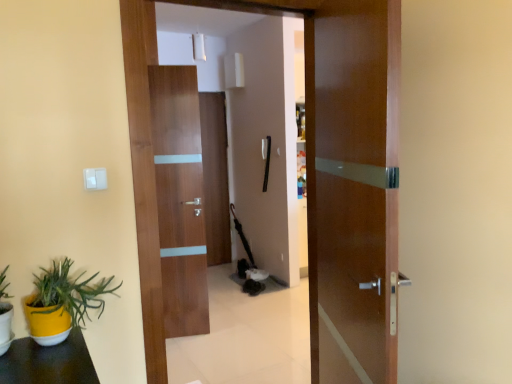
Question: Does glossy wood door at center, arranged as the first door when viewed from the front, lie in front of matte wood door at center, which ranks as the first door in back-to-front order?

Choices:
 (A) yes
 (B) no

Answer: (A)

Question: Is matte wood door at center, which ranks as the first door in back-to-front order, at the back of glossy wood door at center, which ranks as the 4th door in back-to-front order?

Choices:
 (A) yes
 (B) no

Answer: (B)

Question: Is glossy wood door at center, which ranks as the 4th door in back-to-front order, wider than matte wood door at center, positioned as the 4th door in front-to-back order?

Choices:
 (A) no
 (B) yes

Answer: (B)

Question: From a real-world perspective, does glossy wood door at center, which ranks as the 4th door in back-to-front order, stand above matte wood door at center, positioned as the 4th door in front-to-back order?

Choices:
 (A) no
 (B) yes

Answer: (B)

Question: Is glossy wood door at center, arranged as the first door when viewed from the front, smaller than matte wood door at center, which ranks as the first door in back-to-front order?

Choices:
 (A) no
 (B) yes

Answer: (A)

Question: Is glossy wood door at center, which ranks as the 4th door in back-to-front order, aimed at matte wood door at center, positioned as the 4th door in front-to-back order?

Choices:
 (A) no
 (B) yes

Answer: (A)

Question: Is yellow matte flowerpot at lower left smaller than glossy wood door at center, arranged as the first door when viewed from the front?

Choices:
 (A) no
 (B) yes

Answer: (B)

Question: Is yellow matte flowerpot at lower left positioned beyond the bounds of glossy wood door at center, which ranks as the 4th door in back-to-front order?

Choices:
 (A) no
 (B) yes

Answer: (B)

Question: Does yellow matte flowerpot at lower left come behind glossy wood door at center, which ranks as the 4th door in back-to-front order?

Choices:
 (A) no
 (B) yes

Answer: (B)

Question: Considering the relative sizes of yellow matte flowerpot at lower left and glossy wood door at center, which ranks as the 4th door in back-to-front order, in the image provided, is yellow matte flowerpot at lower left bigger than glossy wood door at center, which ranks as the 4th door in back-to-front order,?

Choices:
 (A) yes
 (B) no

Answer: (B)

Question: Is there a large distance between yellow matte flowerpot at lower left and glossy wood door at center, arranged as the first door when viewed from the front?

Choices:
 (A) yes
 (B) no

Answer: (A)

Question: From the image's perspective, is yellow matte flowerpot at lower left on top of glossy wood door at center, arranged as the first door when viewed from the front?

Choices:
 (A) yes
 (B) no

Answer: (B)

Question: Considering the relative sizes of walnut wood door at center, acting as the third door starting from the front, and yellow matte flowerpot at lower left in the image provided, is walnut wood door at center, acting as the third door starting from the front, bigger than yellow matte flowerpot at lower left?

Choices:
 (A) yes
 (B) no

Answer: (A)